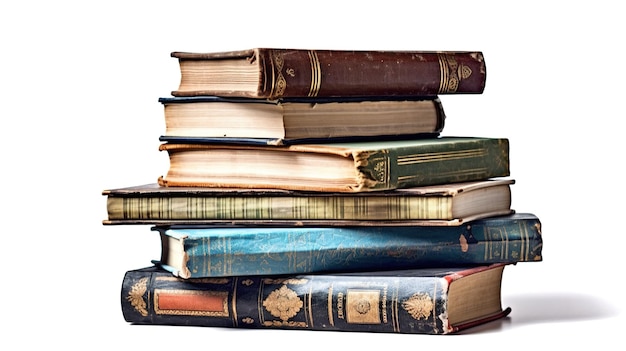
Find the location of a particular element. books is located at coordinates (285, 87), (285, 116), (316, 169), (320, 206), (312, 242), (315, 307).